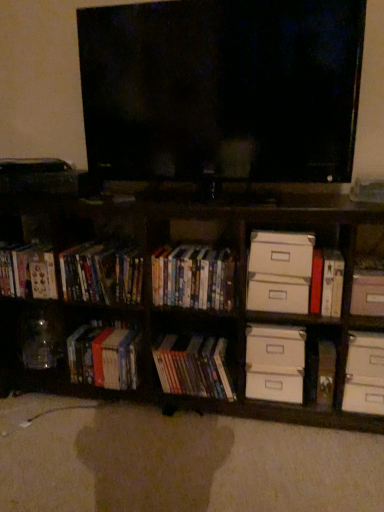
Question: Which direction should I rotate to look at hardcover books at center, which appears as the 4th book when viewed from the left, — up or down?

Choices:
 (A) down
 (B) up

Answer: (A)

Question: Does matte plastic dvds at left, which ranks as the second cabinet in right-to-left order, come behind black glossy flat-screen tv at center?

Choices:
 (A) yes
 (B) no

Answer: (A)

Question: Can black glossy flat-screen tv at center be found inside matte plastic dvds at left, the first cabinet viewed from the left?

Choices:
 (A) no
 (B) yes

Answer: (A)

Question: Can you confirm if matte plastic dvds at left, which ranks as the second cabinet in right-to-left order, is shorter than black glossy flat-screen tv at center?

Choices:
 (A) no
 (B) yes

Answer: (B)

Question: From the image's perspective, is matte plastic dvds at left, the first cabinet viewed from the left, beneath black glossy flat-screen tv at center?

Choices:
 (A) yes
 (B) no

Answer: (A)

Question: Is matte plastic dvds at left, which ranks as the second cabinet in right-to-left order, oriented towards black glossy flat-screen tv at center?

Choices:
 (A) no
 (B) yes

Answer: (A)

Question: From the image's perspective, is matte plastic dvds at left, the first cabinet viewed from the left, over black glossy flat-screen tv at center?

Choices:
 (A) no
 (B) yes

Answer: (A)

Question: Is white cardboard drawer at upper right, which is the fourth drawer from bottom to top, oriented towards matte plastic books at center, positioned as the third book in left-to-right order?

Choices:
 (A) no
 (B) yes

Answer: (A)

Question: Does white cardboard drawer at upper right, which is the fourth drawer from bottom to top, lie behind matte plastic books at center, positioned as the third book in left-to-right order?

Choices:
 (A) no
 (B) yes

Answer: (A)

Question: From a real-world perspective, does white cardboard drawer at upper right, which is the first drawer from top to bottom, sit lower than matte plastic books at center, positioned as the third book in left-to-right order?

Choices:
 (A) no
 (B) yes

Answer: (A)

Question: Would you say matte plastic books at center, the 2th book in the right-to-left sequence, is part of white cardboard drawer at upper right, which is the fourth drawer from bottom to top,'s contents?

Choices:
 (A) no
 (B) yes

Answer: (A)

Question: Is there a large distance between white cardboard drawer at upper right, which is the first drawer from top to bottom, and matte plastic books at center, positioned as the third book in left-to-right order?

Choices:
 (A) yes
 (B) no

Answer: (B)

Question: Considering the relative sizes of white cardboard drawer at upper right, which is the fourth drawer from bottom to top, and matte plastic books at center, positioned as the third book in left-to-right order, in the image provided, is white cardboard drawer at upper right, which is the fourth drawer from bottom to top, wider than matte plastic books at center, positioned as the third book in left-to-right order,?

Choices:
 (A) no
 (B) yes

Answer: (A)

Question: Considering the relative sizes of matte plastic dvds at left, which ranks as the second cabinet in right-to-left order, and wooden bookcase at lower left in the image provided, is matte plastic dvds at left, which ranks as the second cabinet in right-to-left order, taller than wooden bookcase at lower left?

Choices:
 (A) yes
 (B) no

Answer: (B)